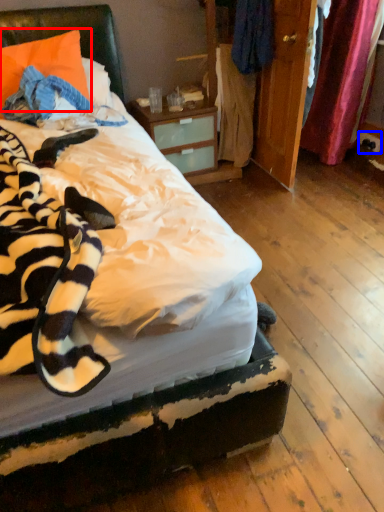
Question: Which of the following is the farthest to the observer, pillow (highlighted by a red box) or power outlet (highlighted by a blue box)?

Choices:
 (A) pillow
 (B) power outlet

Answer: (B)